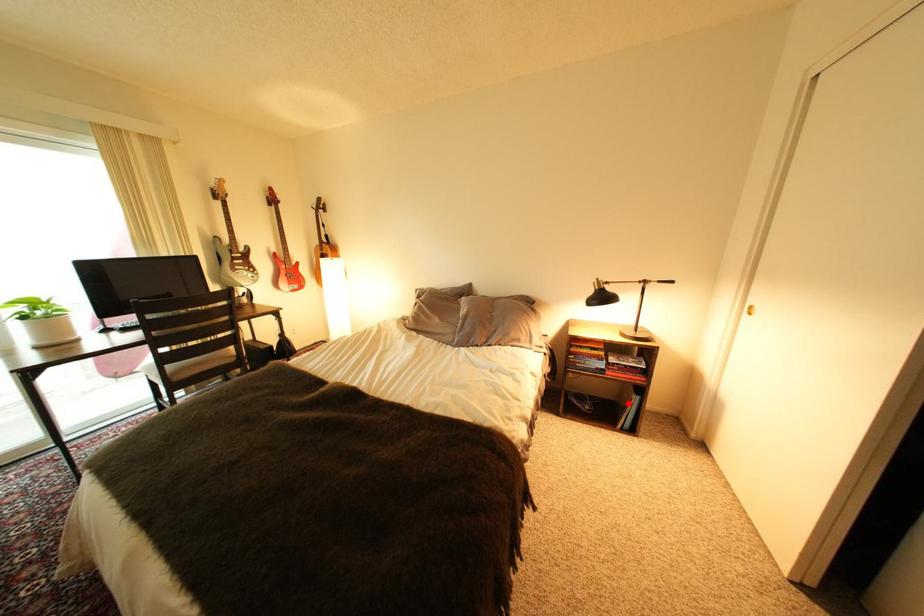
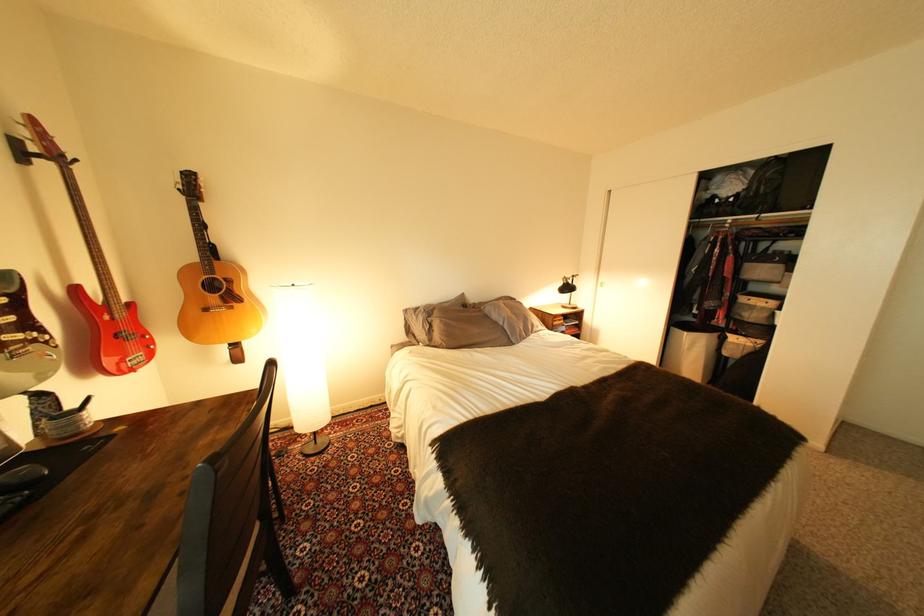
Question: I am providing you with two images of the same scene from different viewpoints. A red point is marked on the first image. Can you still see the location of the red point in image 2?

Choices:
 (A) Yes
 (B) No

Answer: (B)